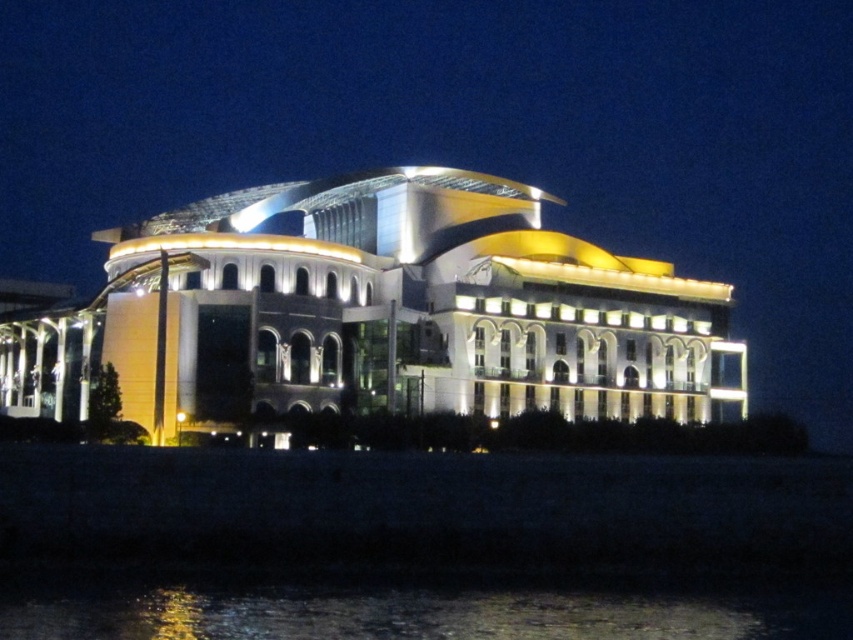
Measure the distance from white glossy building at center to glistening water at lower center.

white glossy building at center is 29.96 meters from glistening water at lower center.

Between white glossy building at center and glistening water at lower center, which one appears on the right side from the viewer's perspective?

glistening water at lower center is more to the right.

Does point (180, 236) lie in front of point (642, 593)?

That is False.

You are a GUI agent. You are given a task and a screenshot of the screen. Output one action in this format:
    pyautogui.click(x=<x>, y=<y>)
    Task: Click on the white glossy building at center
    The height and width of the screenshot is (640, 853).
    Given the screenshot: What is the action you would take?
    [x=376, y=314]